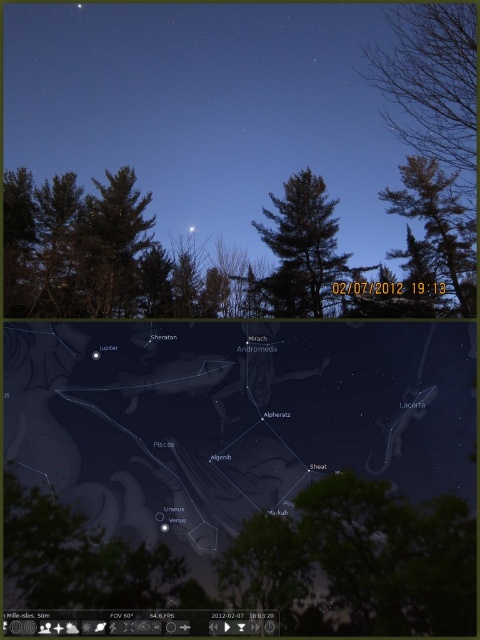
Is matte black stars at upper center behind bare branches at upper right?

That is True.

Is point (223, 212) in front of point (418, 58)?

No, it is behind (418, 58).

Identify the location of matte black stars at upper center. (237, 168).

This screenshot has width=480, height=640. Find the location of `transparent overlay at center`. transparent overlay at center is located at coordinates (244, 468).

Locate an element on the screen. The width and height of the screenshot is (480, 640). transparent overlay at center is located at coordinates (244, 468).

Does green matte tree at center have a larger size compared to brown textured tree at left?

Yes, green matte tree at center is bigger than brown textured tree at left.

Which is below, green matte tree at center or brown textured tree at left?

green matte tree at center

The image size is (480, 640). What do you see at coordinates (300, 248) in the screenshot? I see `green matte tree at center` at bounding box center [300, 248].

Locate an element on the screen. Image resolution: width=480 pixels, height=640 pixels. green matte tree at center is located at coordinates (300, 248).